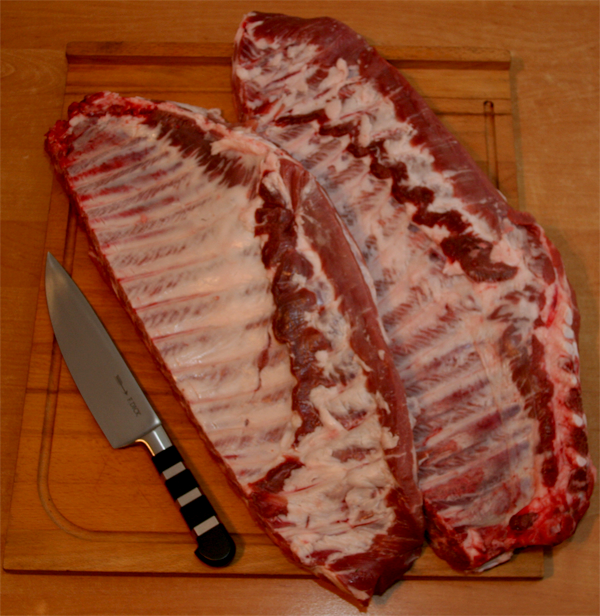
This screenshot has height=616, width=600. Find the location of `handle`. handle is located at coordinates (208, 535).